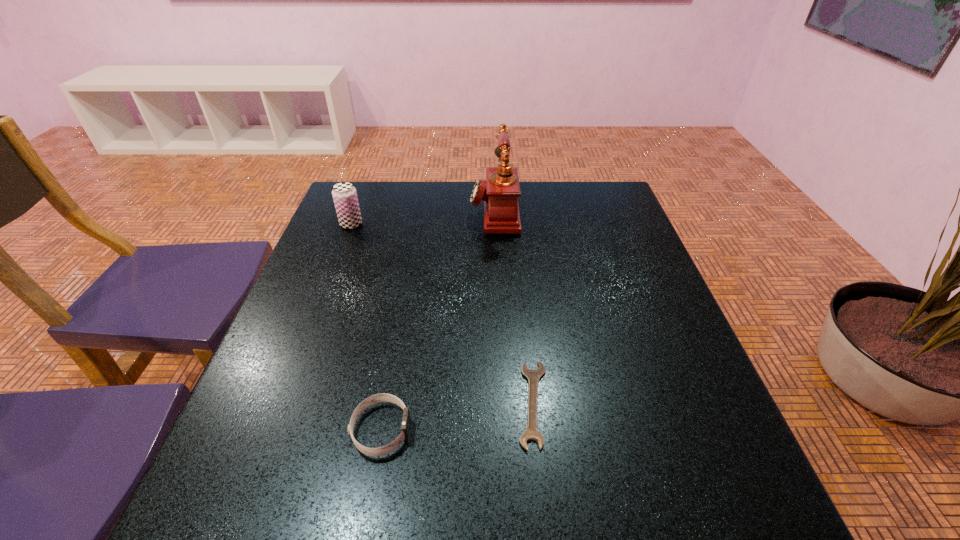
Where is `vacant point located 0.220m on the outer surface of the second shortest object`? The image size is (960, 540). vacant point located 0.220m on the outer surface of the second shortest object is located at coordinates (536, 429).

Find the location of a particular element. vacant position located 0.130m on the left of the wrench is located at coordinates (446, 403).

The width and height of the screenshot is (960, 540). Identify the location of telephone located at the far edge. (500, 192).

Locate an element on the screen. beer can at the far edge is located at coordinates (344, 194).

Locate an element on the screen. object that is at the left edge is located at coordinates point(344,194).

Find the location of `object present at the far left corner`. object present at the far left corner is located at coordinates (344, 194).

This screenshot has height=540, width=960. Identify the location of vacant area at the far edge of the desktop. (558, 224).

This screenshot has width=960, height=540. In the image, there is a desktop. What are the coordinates of `free region at the near edge` in the screenshot? It's located at (537, 481).

At what (x,y) coordinates should I click in order to perform the action: click on vacant space at the left edge of the desktop. Please return your answer as a coordinate pair (x, y). Image resolution: width=960 pixels, height=540 pixels. Looking at the image, I should click on (347, 265).

At what (x,y) coordinates should I click in order to perform the action: click on free space at the right edge of the desktop. Please return your answer as a coordinate pair (x, y). Looking at the image, I should click on (596, 256).